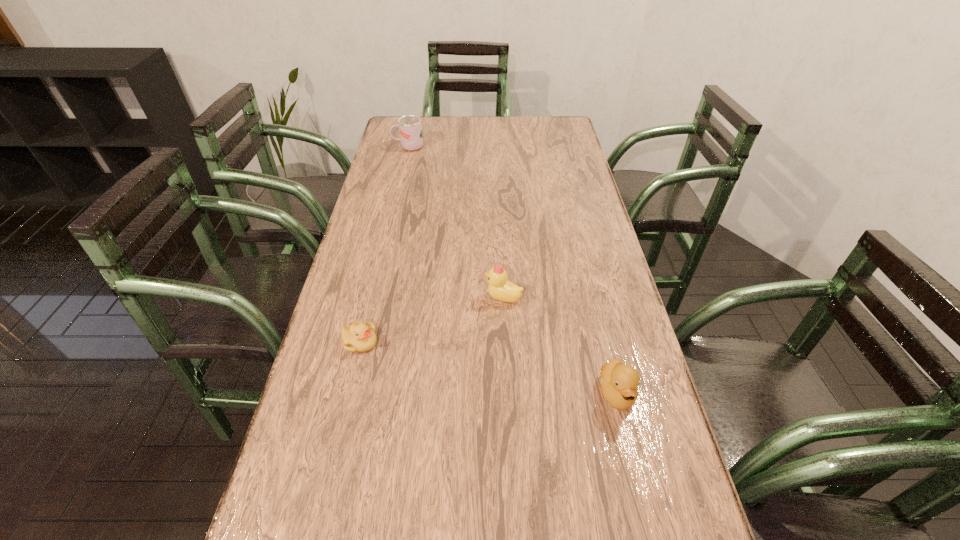
The width and height of the screenshot is (960, 540). In the image, there is a desktop. What are the coordinates of `vacant space at the right edge` in the screenshot? It's located at (605, 294).

Where is `free space at the far left corner`? This screenshot has width=960, height=540. free space at the far left corner is located at coordinates (399, 136).

Find the location of a particular element. This screenshot has width=960, height=540. blank space at the far right corner of the desktop is located at coordinates (540, 133).

I want to click on free area in between the farthest duckling and the cup, so click(x=456, y=222).

Locate an element on the screen. The image size is (960, 540). blank region between the farthest duckling and the third farthest object is located at coordinates (431, 320).

The image size is (960, 540). I want to click on blank region between the third nearest object and the nearest object, so click(x=560, y=345).

You are a GUI agent. You are given a task and a screenshot of the screen. Output one action in this format:
    pyautogui.click(x=<x>, y=<y>)
    Task: Click on the vacant space that is in between the farthest duckling and the rightmost object
    The width and height of the screenshot is (960, 540).
    Given the screenshot: What is the action you would take?
    pyautogui.click(x=560, y=345)

This screenshot has height=540, width=960. I want to click on free point between the tallest object and the shortest object, so click(385, 245).

Where is `vacant space that is in between the farthest duckling and the rightmost duckling`? This screenshot has width=960, height=540. vacant space that is in between the farthest duckling and the rightmost duckling is located at coordinates (560, 345).

This screenshot has width=960, height=540. Identify the location of free area in between the rightmost duckling and the shortest object. (489, 367).